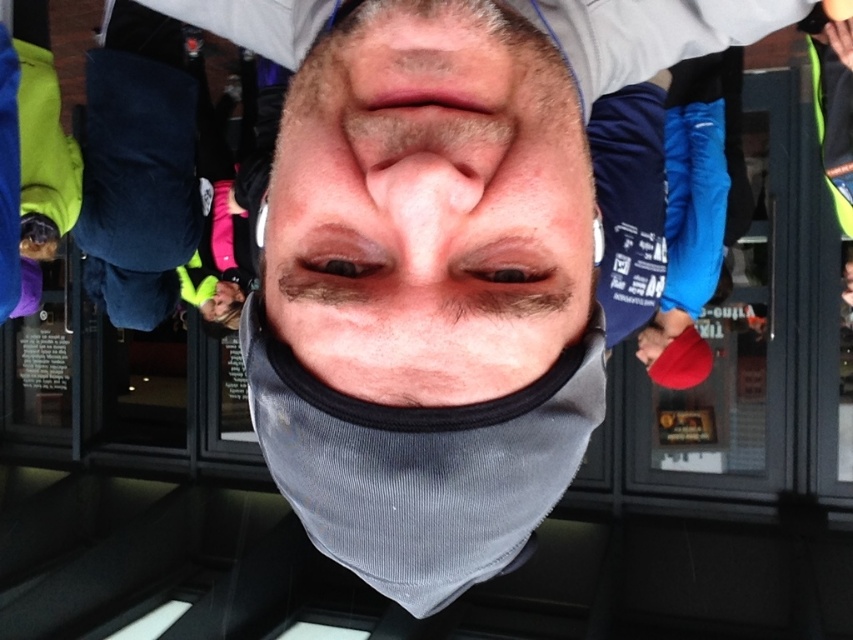
Question: Considering the real-world distances, which object is closest to the gray fabric face at center?

Choices:
 (A) smooth flesh nose at center
 (B) pink flesh-colored nose at center

Answer: (B)

Question: Does gray fabric face at center have a lesser width compared to pink flesh-colored nose at center?

Choices:
 (A) yes
 (B) no

Answer: (B)

Question: Which object is the closest to the smooth flesh nose at center?

Choices:
 (A) gray fabric face at center
 (B) pink flesh-colored nose at center

Answer: (B)

Question: Is gray fabric face at center wider than smooth flesh nose at center?

Choices:
 (A) yes
 (B) no

Answer: (A)

Question: Which object appears closest to the camera in this image?

Choices:
 (A) gray fabric face at center
 (B) smooth flesh nose at center

Answer: (A)

Question: Is smooth flesh nose at center below pink flesh-colored nose at center?

Choices:
 (A) no
 (B) yes

Answer: (A)